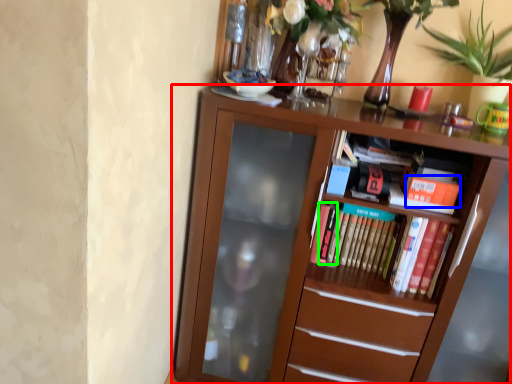
Question: Based on their relative distances, which object is nearer to bookcase (highlighted by a red box)? Choose from paperback book (highlighted by a blue box) and paperback book (highlighted by a green box).

Choices:
 (A) paperback book
 (B) paperback book

Answer: (B)